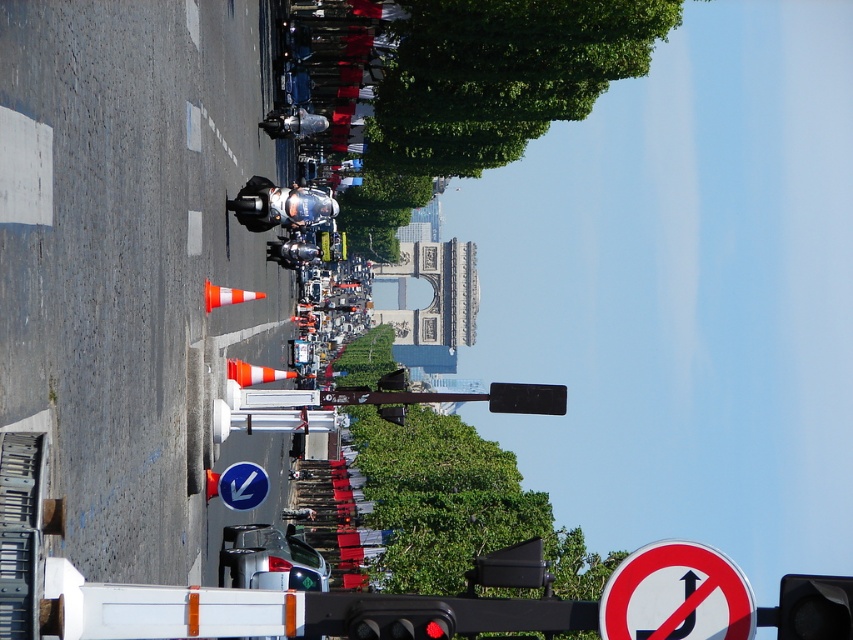
You are a tourist in Paris and you see the Arc de Triomphe in the background. You want to take a photo of the white plastic sign at lower right. Where should you stand to take the photo?

You should stand at point (676, 595) to take the photo of the white plastic sign at lower right.

You are a delivery driver approaching the intersection shown. You see the white plastic sign at lower right and the red glass traffic light at center. Which object is nearer to you as you drive towards the intersection?

The white plastic sign at lower right is closer to the viewer than the red glass traffic light at center, so the white plastic sign at lower right is nearer as you drive towards the intersection.